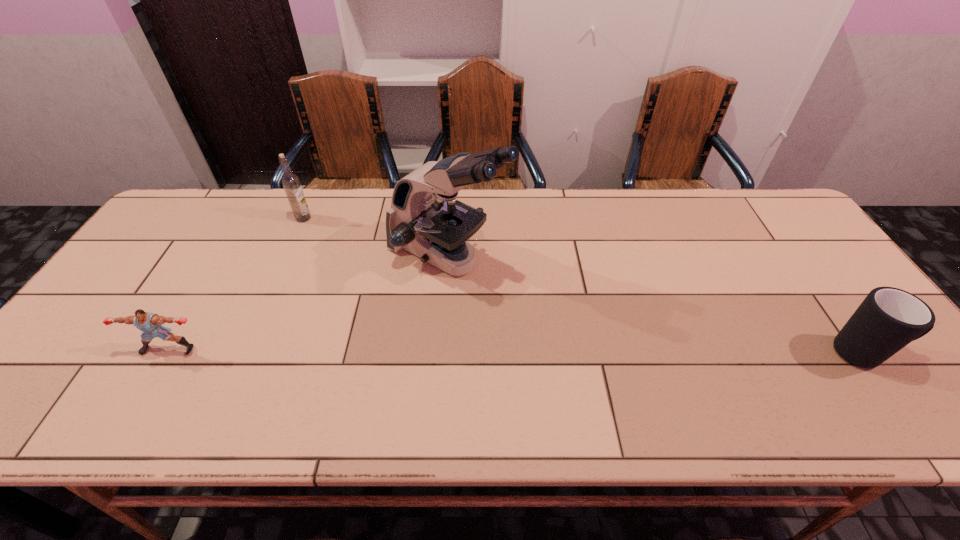
This screenshot has width=960, height=540. In order to click on object at the right edge in this screenshot , I will do `click(888, 319)`.

Where is `object at the near left corner`? This screenshot has width=960, height=540. object at the near left corner is located at coordinates (150, 324).

Where is `object at the near right corner`? object at the near right corner is located at coordinates (888, 319).

In the image, there is a desktop. Identify the location of vacant space at the far edge. The image size is (960, 540). (238, 211).

I want to click on vacant area at the near edge, so [127, 390].

In the image, there is a desktop. Where is `vacant space at the left edge`? This screenshot has height=540, width=960. vacant space at the left edge is located at coordinates (126, 295).

Identify the location of vacant space at the right edge of the desktop. (841, 293).

Locate an element on the screen. free space at the far right corner is located at coordinates (766, 214).

Find the location of `free space between the tallest object and the rightmost object`. free space between the tallest object and the rightmost object is located at coordinates (657, 306).

Image resolution: width=960 pixels, height=540 pixels. In order to click on free space between the second shortest object and the leftmost object in this screenshot , I will do `click(517, 351)`.